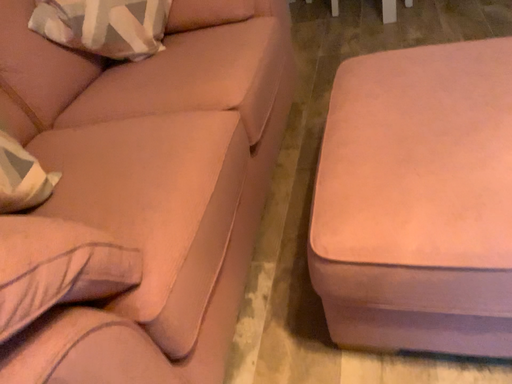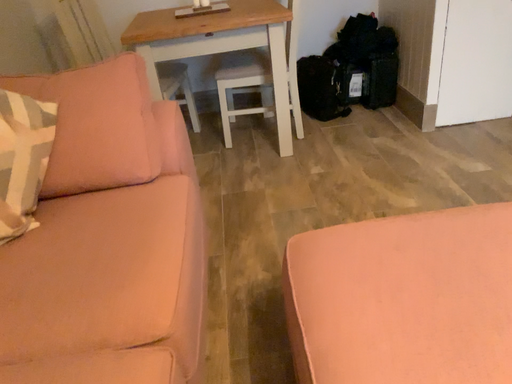
Question: How did the camera likely rotate when shooting the video?

Choices:
 (A) rotated left
 (B) rotated right

Answer: (B)